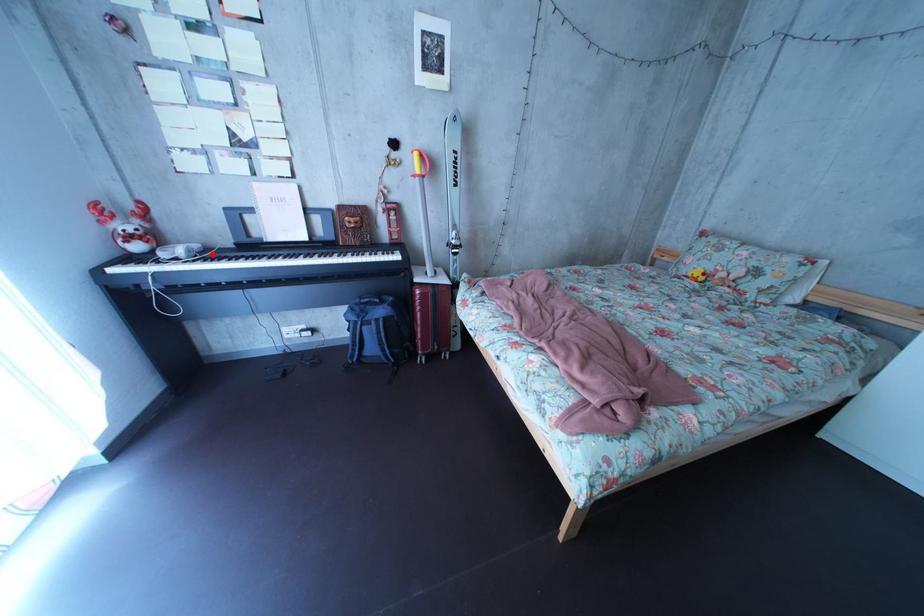
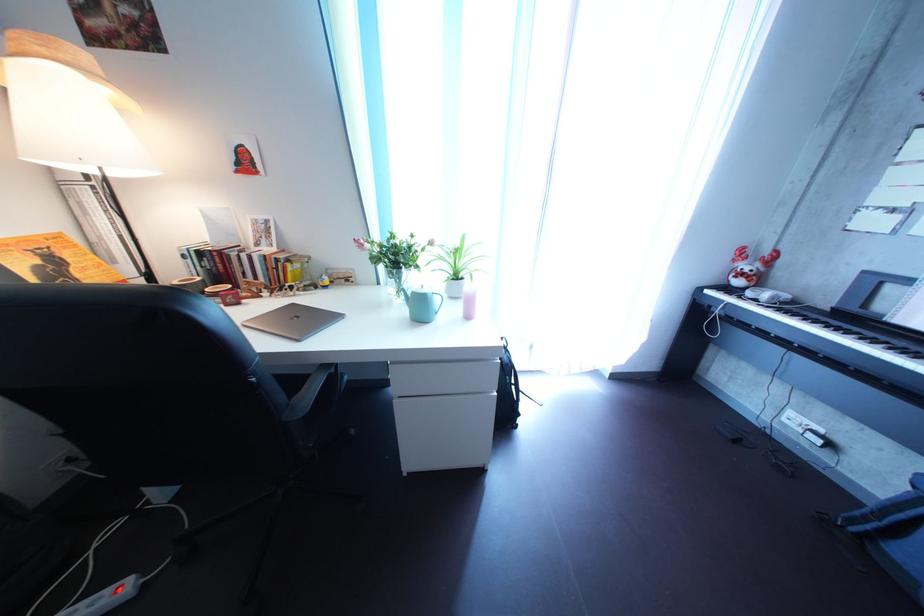
Locate, in the second image, the point that corresponds to the highlighted location in the first image.

(801, 304)